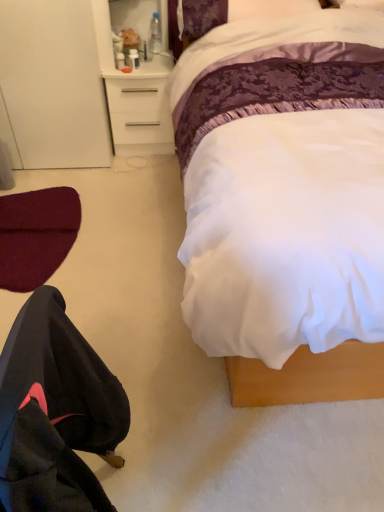
Question: Is clear plastic bottle at upper center located outside white satin bed at center?

Choices:
 (A) yes
 (B) no

Answer: (A)

Question: Is clear plastic bottle at upper center positioned in front of white satin bed at center?

Choices:
 (A) yes
 (B) no

Answer: (B)

Question: Considering the relative sizes of clear plastic bottle at upper center and white satin bed at center in the image provided, is clear plastic bottle at upper center smaller than white satin bed at center?

Choices:
 (A) no
 (B) yes

Answer: (B)

Question: Does clear plastic bottle at upper center have a greater width compared to white satin bed at center?

Choices:
 (A) no
 (B) yes

Answer: (A)

Question: Does clear plastic bottle at upper center have a lesser width compared to white satin bed at center?

Choices:
 (A) no
 (B) yes

Answer: (B)

Question: Is clear plastic bottle at upper center bigger or smaller than white satin bed at center?

Choices:
 (A) big
 (B) small

Answer: (B)

Question: From their relative heights in the image, would you say clear plastic bottle at upper center is taller or shorter than white satin bed at center?

Choices:
 (A) short
 (B) tall

Answer: (A)

Question: Considering their positions, is clear plastic bottle at upper center located in front of or behind white satin bed at center?

Choices:
 (A) behind
 (B) front

Answer: (A)

Question: Is clear plastic bottle at upper center inside or outside of white satin bed at center?

Choices:
 (A) outside
 (B) inside

Answer: (A)

Question: In terms of height, does white plastic desk at upper center look taller or shorter compared to black fabric robe at lower left?

Choices:
 (A) short
 (B) tall

Answer: (A)

Question: In the image, is white plastic desk at upper center on the left side or the right side of black fabric robe at lower left?

Choices:
 (A) right
 (B) left

Answer: (A)

Question: Is point (112, 96) positioned closer to the camera than point (76, 500)?

Choices:
 (A) closer
 (B) farther

Answer: (B)

Question: Relative to black fabric robe at lower left, is white plastic desk at upper center in front or behind?

Choices:
 (A) front
 (B) behind

Answer: (B)

Question: Considering the positions of black fabric robe at lower left and white plastic desk at upper center in the image, is black fabric robe at lower left wider or thinner than white plastic desk at upper center?

Choices:
 (A) thin
 (B) wide

Answer: (A)

Question: Looking at the image, does black fabric robe at lower left seem bigger or smaller compared to white plastic desk at upper center?

Choices:
 (A) small
 (B) big

Answer: (B)